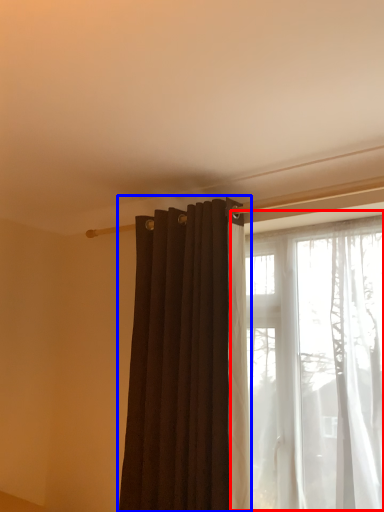
Question: Which object is closer to the camera taking this photo, window (highlighted by a red box) or curtain (highlighted by a blue box)?

Choices:
 (A) window
 (B) curtain

Answer: (A)